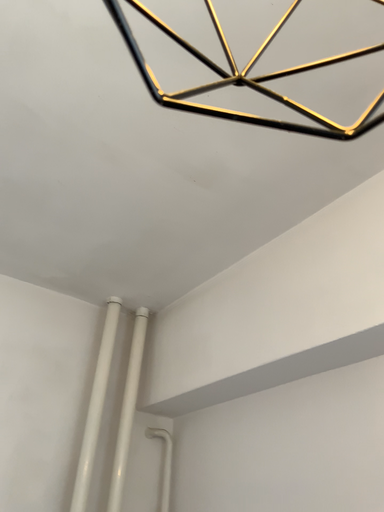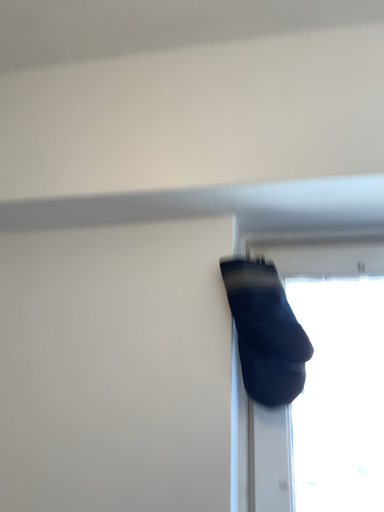
Question: How did the camera likely rotate when shooting the video?

Choices:
 (A) rotated downward
 (B) rotated upward

Answer: (A)